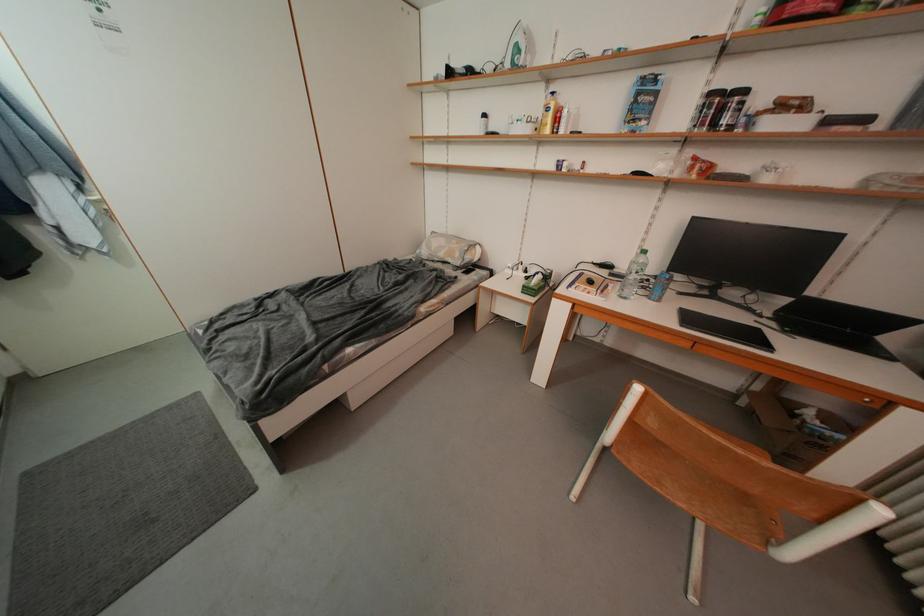
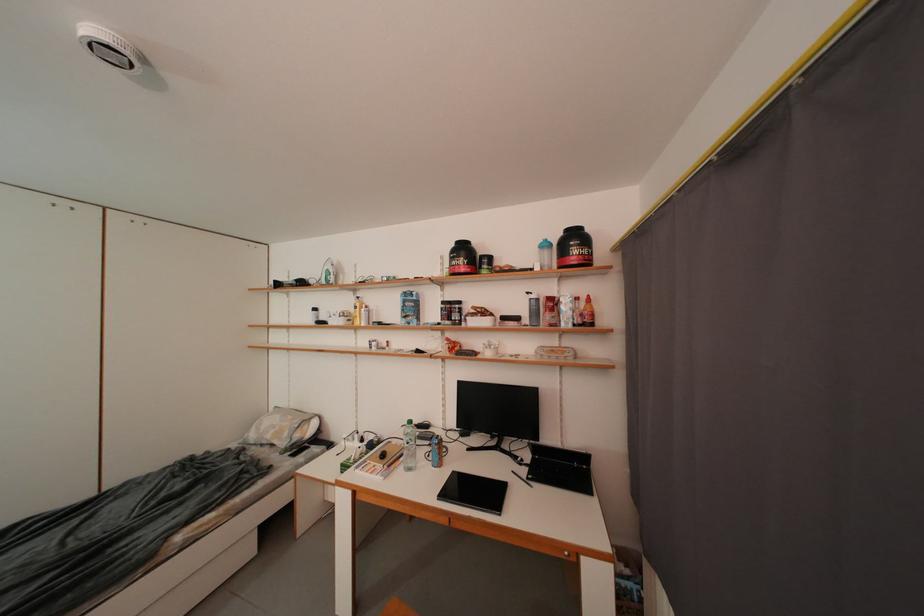
Find the pixel in the second image that matches point 617,292 in the first image.

(409, 462)